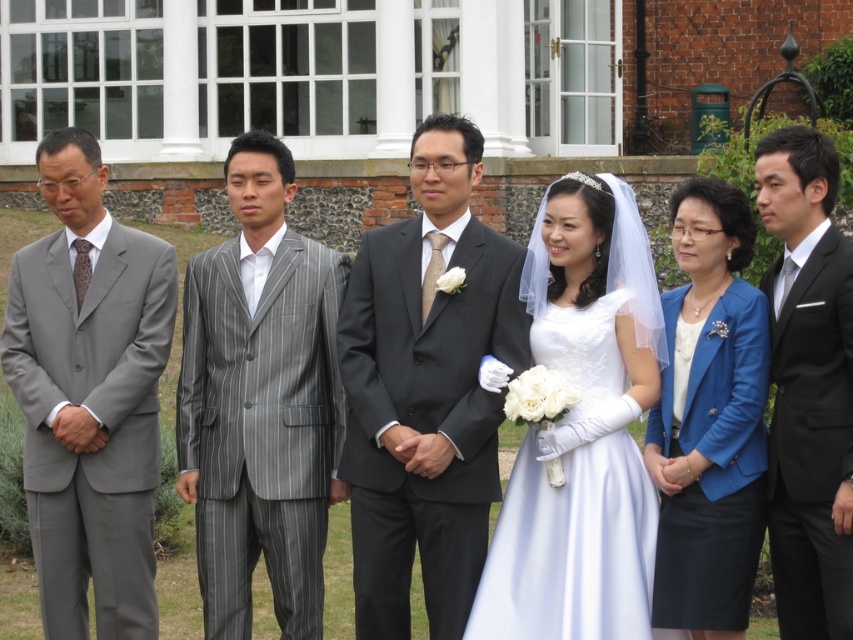
From the picture: Based on the scene description, which individual is wearing a suit that is larger in size between the gray pinstripe suit at center and the black satin suit at right?

The gray pinstripe suit at center is larger in size than the black satin suit at right.

Based on the scene description, which individual is wearing a wider suit between the gray pinstripe suit at center and the black satin suit at right?

The gray pinstripe suit at center is wider than the black satin suit at right according to the description.

Based on the scene description, which of the two men in gray suits, the gray pinstripe suit at center or the matte gray suit at left, is positioned closer to the ground?

The gray pinstripe suit at center is located below matte gray suit at left, so it is closer to the ground.